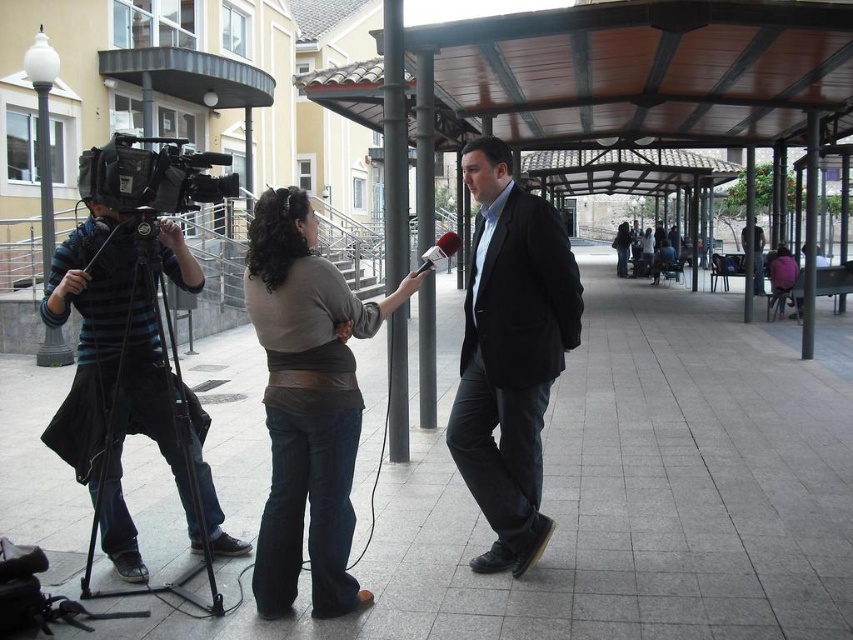
Question: Is brown leather jacket at center positioned behind black matte camera at left?

Choices:
 (A) yes
 (B) no

Answer: (B)

Question: Considering the relative positions of black matte video camera at left and red fabric microphone at center in the image provided, where is black matte video camera at left located with respect to red fabric microphone at center?

Choices:
 (A) right
 (B) left

Answer: (B)

Question: Among these objects, which one is nearest to the camera?

Choices:
 (A) red fabric microphone at center
 (B) black matte camera at left
 (C) matte black suit at center
 (D) brown leather jacket at center

Answer: (D)

Question: Which point is closer to the camera?

Choices:
 (A) (51, 294)
 (B) (292, 436)
 (C) (234, 173)
 (D) (436, 248)

Answer: (B)

Question: Which point appears farthest from the camera in this image?

Choices:
 (A) (213, 202)
 (B) (474, 404)
 (C) (442, 248)
 (D) (225, 552)

Answer: (A)

Question: Does brown leather jacket at center appear on the left side of black matte video camera at left?

Choices:
 (A) yes
 (B) no

Answer: (B)